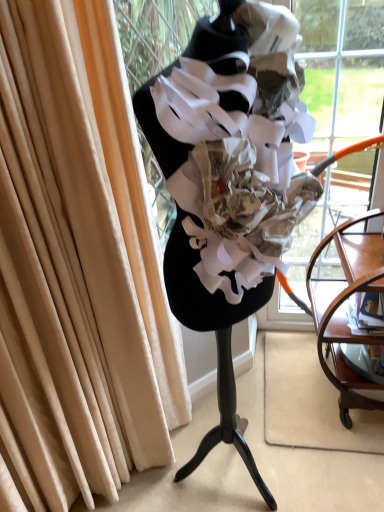
Question: From a real-world perspective, is clear glass shelf at lower right above or below mahogany wood side table at right?

Choices:
 (A) above
 (B) below

Answer: (B)

Question: From their relative heights in the image, would you say clear glass shelf at lower right is taller or shorter than mahogany wood side table at right?

Choices:
 (A) tall
 (B) short

Answer: (B)

Question: Considering the real-world distances, which object is farthest from the clear glass shelf at lower right?

Choices:
 (A) transparent glass shop window at center
 (B) mahogany wood side table at right
 (C) beige velvet curtain at left

Answer: (C)

Question: Estimate the real-world distances between objects in this image. Which object is farther from the beige velvet curtain at left?

Choices:
 (A) transparent glass shop window at center
 (B) clear glass shelf at lower right
 (C) mahogany wood side table at right

Answer: (B)